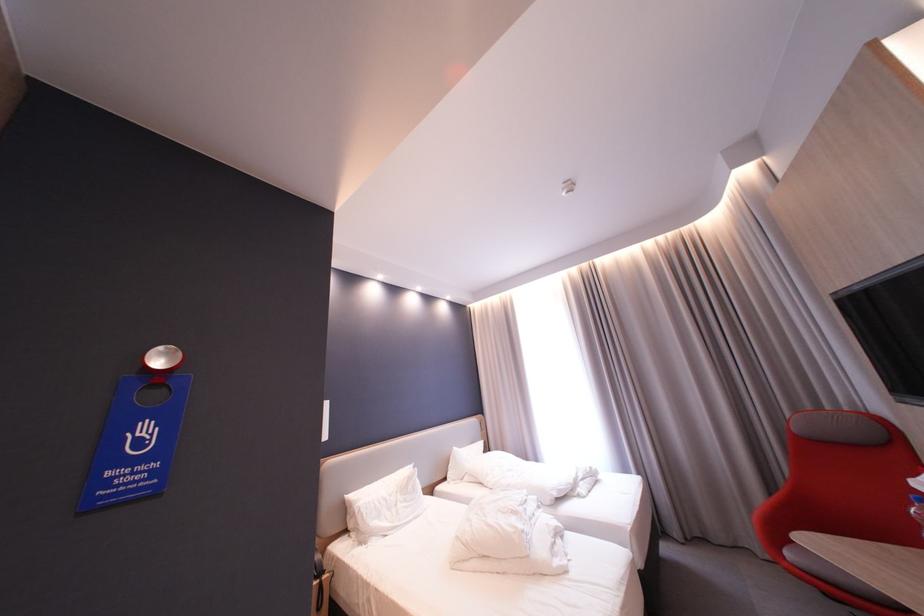
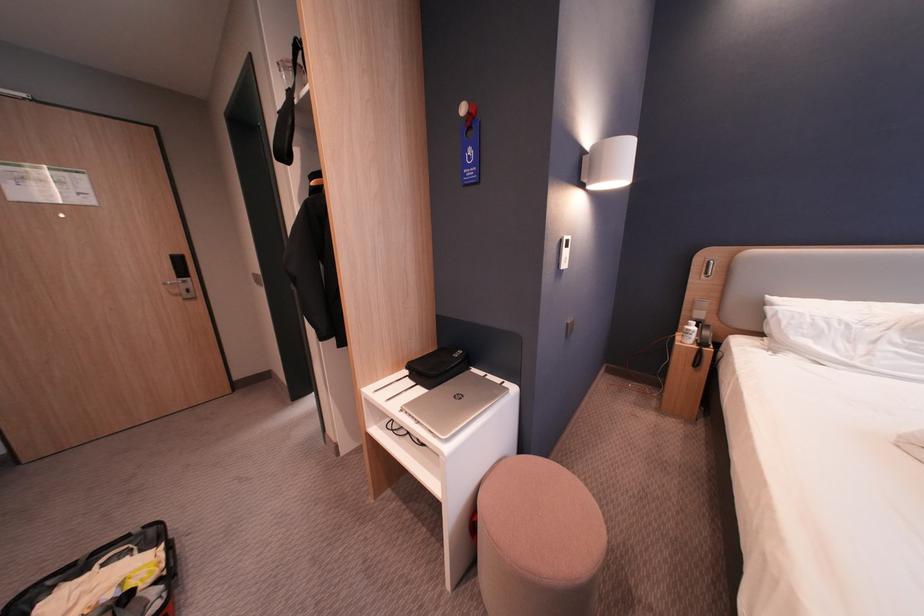
Find the pixel in the second image that matches (120,474) in the first image.

(477, 172)